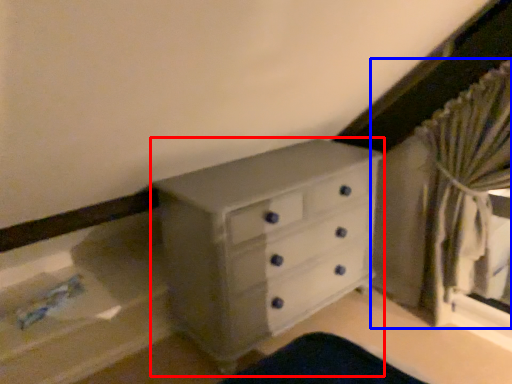
Question: Which object appears closest to the camera in this image, chest of drawers (highlighted by a red box) or curtain (highlighted by a blue box)?

Choices:
 (A) chest of drawers
 (B) curtain

Answer: (B)